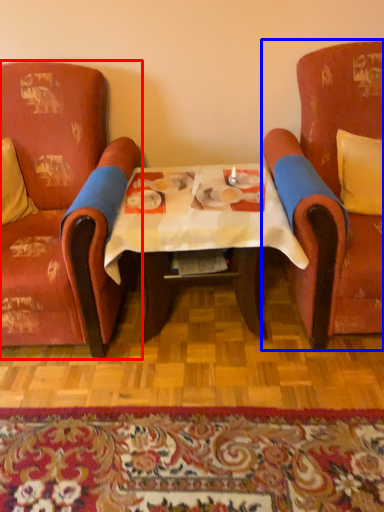
Question: Which point is closer to the camera, chair (highlighted by a red box) or chair (highlighted by a blue box)?

Choices:
 (A) chair
 (B) chair

Answer: (B)